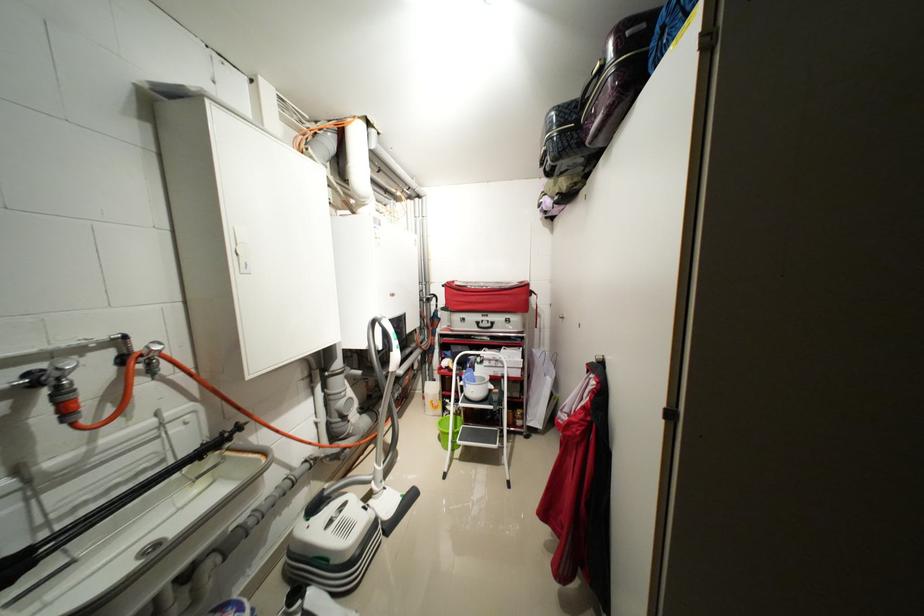
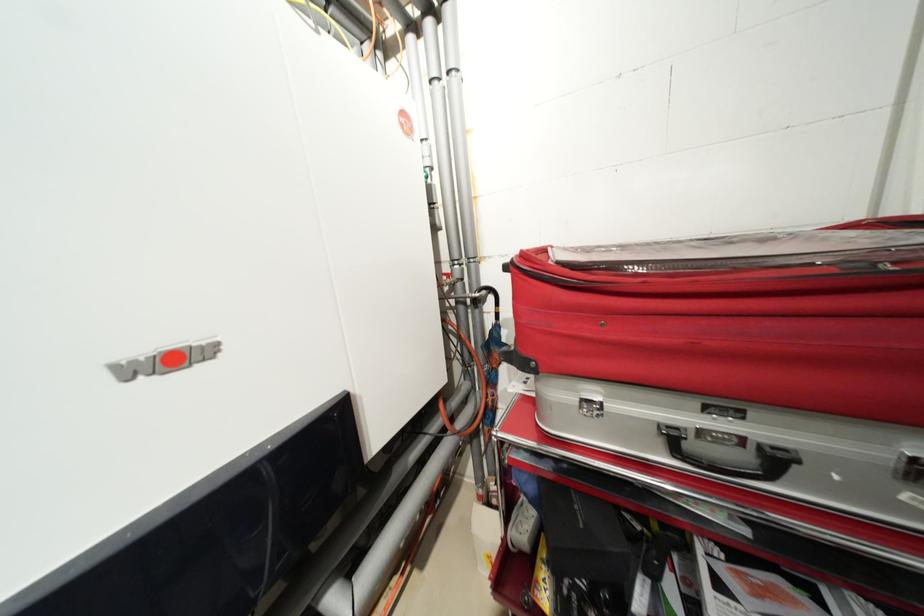
Question: What movement of the cameraman would produce the second image?

Choices:
 (A) Left
 (B) Right
 (C) Forward
 (D) Backward

Answer: (C)